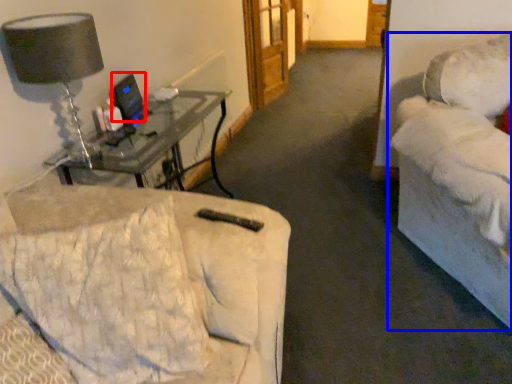
Question: Which object appears closest to the camera in this image, computer monitor (highlighted by a red box) or studio couch (highlighted by a blue box)?

Choices:
 (A) computer monitor
 (B) studio couch

Answer: (B)